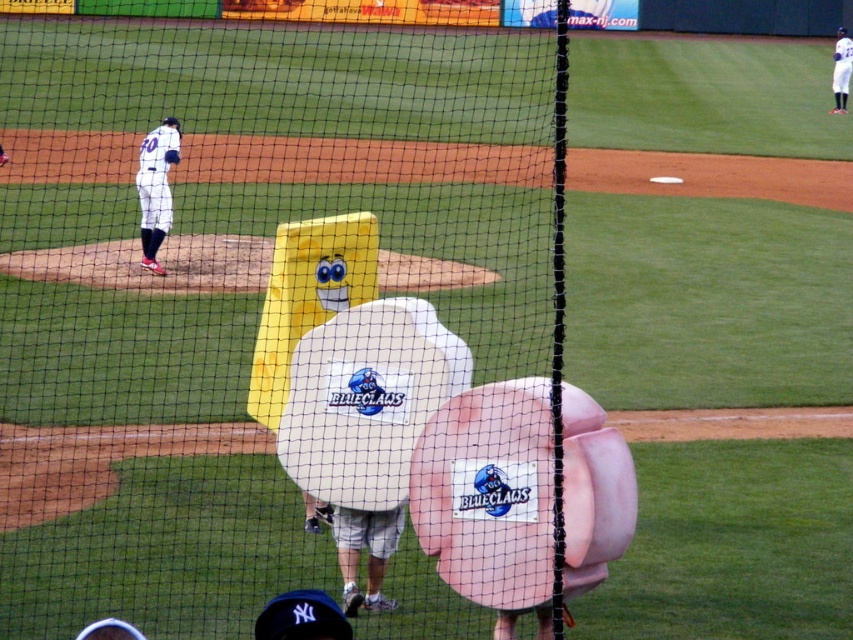
You are a photographer trying to capture the baseball pitcher in the image. The black mesh net at center and matte white glove at upper center are in your view. Since you want to focus on the pitcher, which object should you avoid blocking the lens with?

The black mesh net at center is larger in size than the matte white glove at upper center, so you should avoid blocking the lens with the black mesh net at center to focus on the pitcher.